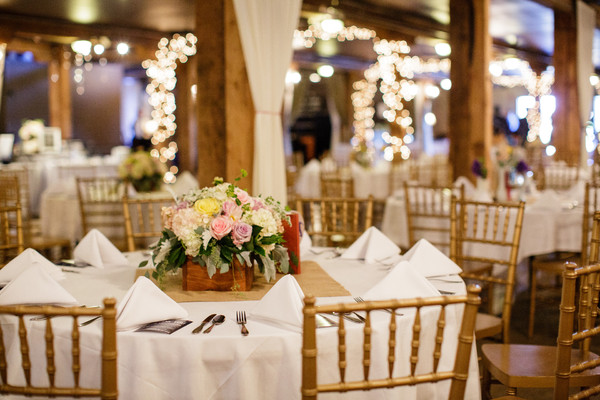
Locate an element on the screen. wooden rectangular surface is located at coordinates (319, 281).